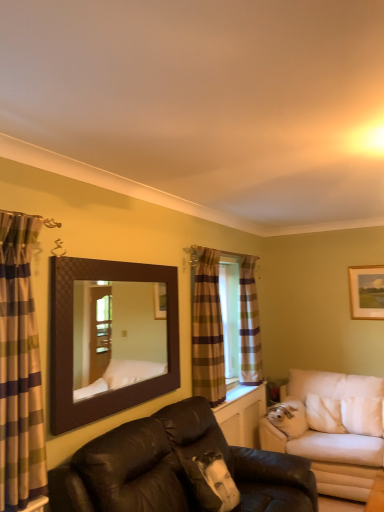
This screenshot has width=384, height=512. Describe the element at coordinates (175, 468) in the screenshot. I see `leather couch at center, the 2th studio couch when ordered from right to left` at that location.

Describe the element at coordinates (330, 430) in the screenshot. I see `white fabric studio couch at right, acting as the 2th studio couch starting from the front` at that location.

Where is `white fabric studio couch at right, which ranks as the 2th studio couch in left-to-right order`? white fabric studio couch at right, which ranks as the 2th studio couch in left-to-right order is located at coordinates [330, 430].

Locate an element on the screen. plaid fabric curtain at window, the third curtain in the left-to-right sequence is located at coordinates (249, 325).

This screenshot has width=384, height=512. What do you see at coordinates (19, 368) in the screenshot?
I see `plaid fabric curtain at left, marked as the third curtain in a right-to-left arrangement` at bounding box center [19, 368].

In order to face brown textured mirror at upper center, should I rotate leftwards or rightwards?

A 8.790 degree turn to the left will do.

Locate an element on the screen. The width and height of the screenshot is (384, 512). leather couch at center, which is counted as the 1th studio couch, starting from the left is located at coordinates (175, 468).

Is leather couch at center, which is counted as the 1th studio couch, starting from the left, in front of brown textured mirror at upper center?

Yes, the depth of leather couch at center, which is counted as the 1th studio couch, starting from the left, is less than that of brown textured mirror at upper center.

Based on the photo, is leather couch at center, which ranks as the 2th studio couch in back-to-front order, completely or partially outside of brown textured mirror at upper center?

Indeed, leather couch at center, which ranks as the 2th studio couch in back-to-front order, is completely outside brown textured mirror at upper center.

From a real-world perspective, is leather couch at center, which ranks as the 2th studio couch in back-to-front order, above or below brown textured mirror at upper center?

Clearly, from a real-world perspective, leather couch at center, which ranks as the 2th studio couch in back-to-front order, is below brown textured mirror at upper center.

The width and height of the screenshot is (384, 512). What are the coordinates of `mirror behind the leather couch at center, the 2th studio couch when ordered from right to left` in the screenshot? It's located at (110, 338).

Is plaid fabric curtain at center, which is counted as the second curtain, starting from the front, oriented towards leather couch at center, the 2th studio couch when ordered from right to left?

No.

From the image's perspective, count 1st studio couchs downward from the plaid fabric curtain at center, which is counted as the second curtain, starting from the front, and point to it. Please provide its 2D coordinates.

[(175, 468)]

Which object is positioned more to the right, plaid fabric curtain at center, placed as the second curtain when sorted from right to left, or leather couch at center, which ranks as the 2th studio couch in back-to-front order?

plaid fabric curtain at center, placed as the second curtain when sorted from right to left, is more to the right.

Can you confirm if plaid fabric curtain at center, placed as the second curtain when sorted from right to left, is smaller than leather couch at center, which is the 1th studio couch in front-to-back order?

Yes, plaid fabric curtain at center, placed as the second curtain when sorted from right to left, is smaller than leather couch at center, which is the 1th studio couch in front-to-back order.

Between plaid fabric curtain at center, placed as the second curtain when sorted from right to left, and wooden framed picture at upper right, which one is positioned behind?

wooden framed picture at upper right is behind.

Considering the sizes of objects plaid fabric curtain at center, which is counted as the second curtain, starting from the front, and wooden framed picture at upper right in the image provided, who is taller, plaid fabric curtain at center, which is counted as the second curtain, starting from the front, or wooden framed picture at upper right?

plaid fabric curtain at center, which is counted as the second curtain, starting from the front, is taller.

Is wooden framed picture at upper right a part of plaid fabric curtain at center, placed as the second curtain when sorted from right to left?

Actually, wooden framed picture at upper right is outside plaid fabric curtain at center, placed as the second curtain when sorted from right to left.

From a real-world perspective, is plaid fabric curtain at center, placed as the second curtain when sorted from right to left, physically located above or below wooden framed picture at upper right?

From a real-world perspective, plaid fabric curtain at center, placed as the second curtain when sorted from right to left, is physically below wooden framed picture at upper right.

Is leather couch at center, the 2th studio couch when ordered from right to left, thinner than plaid fabric curtain at window, the 1th curtain viewed from the right?

No.

Considering the positions of point (202, 423) and point (257, 367), is point (202, 423) closer or farther from the camera than point (257, 367)?

Point (202, 423) appears to be closer to the viewer than point (257, 367).

Can you confirm if leather couch at center, the 2th studio couch when ordered from right to left, is taller than plaid fabric curtain at window, the third curtain in the front-to-back sequence?

Incorrect, the height of leather couch at center, the 2th studio couch when ordered from right to left, is not larger of that of plaid fabric curtain at window, the third curtain in the front-to-back sequence.

Is leather couch at center, the 2th studio couch when ordered from right to left, completely or partially outside of plaid fabric curtain at window, the third curtain in the front-to-back sequence?

leather couch at center, the 2th studio couch when ordered from right to left, lies outside plaid fabric curtain at window, the third curtain in the front-to-back sequence,'s area.

Can you see leather couch at center, which is the 1th studio couch in front-to-back order, touching white fabric studio couch at right, placed as the first studio couch when sorted from right to left?

No, leather couch at center, which is the 1th studio couch in front-to-back order, is not making contact with white fabric studio couch at right, placed as the first studio couch when sorted from right to left.

Can white fabric studio couch at right, which ranks as the first studio couch in back-to-front order, be found inside leather couch at center, which is the 1th studio couch in front-to-back order?

No, white fabric studio couch at right, which ranks as the first studio couch in back-to-front order, is not inside leather couch at center, which is the 1th studio couch in front-to-back order.

From a real-world perspective, is leather couch at center, which is the 1th studio couch in front-to-back order, below white fabric studio couch at right, acting as the 2th studio couch starting from the front?

No, from a real-world perspective, leather couch at center, which is the 1th studio couch in front-to-back order, is not under white fabric studio couch at right, acting as the 2th studio couch starting from the front.

From the image's perspective, which is below, leather couch at center, the 2th studio couch when ordered from right to left, or white fabric studio couch at right, which ranks as the first studio couch in back-to-front order?

white fabric studio couch at right, which ranks as the first studio couch in back-to-front order, from the image's perspective.

Consider the image. Is plaid fabric curtain at window, the third curtain in the front-to-back sequence, in front of wooden framed picture at upper right?

Yes, the depth of plaid fabric curtain at window, the third curtain in the front-to-back sequence, is less than that of wooden framed picture at upper right.

From the image's perspective, does plaid fabric curtain at window, the 1th curtain viewed from the right, appear higher than wooden framed picture at upper right?

Actually, plaid fabric curtain at window, the 1th curtain viewed from the right, appears below wooden framed picture at upper right in the image.

Is plaid fabric curtain at window, arranged as the 1th curtain when viewed from the back, wider than wooden framed picture at upper right?

Indeed, plaid fabric curtain at window, arranged as the 1th curtain when viewed from the back, has a greater width compared to wooden framed picture at upper right.

Could you measure the distance between plaid fabric curtain at window, the third curtain in the front-to-back sequence, and wooden framed picture at upper right?

plaid fabric curtain at window, the third curtain in the front-to-back sequence, is 3.88 feet from wooden framed picture at upper right.

You are a GUI agent. You are given a task and a screenshot of the screen. Output one action in this format:
    pyautogui.click(x=<x>, y=<y>)
    Task: Click on the studio couch on the right of the plaid fabric curtain at window, the 1th curtain viewed from the right
    The image size is (384, 512).
    Given the screenshot: What is the action you would take?
    pyautogui.click(x=330, y=430)

Which object is thinner, plaid fabric curtain at window, the 1th curtain viewed from the right, or white fabric studio couch at right, placed as the first studio couch when sorted from right to left?

plaid fabric curtain at window, the 1th curtain viewed from the right, is thinner.

Do you think plaid fabric curtain at window, the 1th curtain viewed from the right, is within white fabric studio couch at right, which ranks as the 2th studio couch in left-to-right order, or outside of it?

The correct answer is: outside.

Is plaid fabric curtain at window, the third curtain in the front-to-back sequence, looking in the opposite direction of white fabric studio couch at right, which ranks as the 2th studio couch in left-to-right order?

No, plaid fabric curtain at window, the third curtain in the front-to-back sequence,'s orientation is not away from white fabric studio couch at right, which ranks as the 2th studio couch in left-to-right order.

Where is `mirror located on the left of leather couch at center, which is the 1th studio couch in front-to-back order`? mirror located on the left of leather couch at center, which is the 1th studio couch in front-to-back order is located at coordinates click(x=110, y=338).

The width and height of the screenshot is (384, 512). There is a plaid fabric curtain at center, marked as the second curtain in a left-to-right arrangement. Identify the location of the 1st studio couch below it (from a real-world perspective). (175, 468).

Which object lies further to the anchor point plaid fabric curtain at left, which is counted as the first curtain, starting from the left, plaid fabric curtain at center, marked as the second curtain in a left-to-right arrangement, or plaid fabric curtain at window, the 1th curtain viewed from the right?

plaid fabric curtain at window, the 1th curtain viewed from the right.

When comparing their distances from white fabric studio couch at right, acting as the 2th studio couch starting from the front, does plaid fabric curtain at left, marked as the third curtain in a right-to-left arrangement, or plaid fabric curtain at window, the 1th curtain viewed from the right, seem closer?

plaid fabric curtain at window, the 1th curtain viewed from the right.

Estimate the real-world distances between objects in this image. Which object is further from plaid fabric curtain at center, which ranks as the second curtain in back-to-front order, white fabric studio couch at right, placed as the first studio couch when sorted from right to left, or brown textured mirror at upper center?

white fabric studio couch at right, placed as the first studio couch when sorted from right to left, is further to plaid fabric curtain at center, which ranks as the second curtain in back-to-front order.

When comparing their distances from plaid fabric curtain at window, the third curtain in the front-to-back sequence, does white fabric studio couch at right, which ranks as the first studio couch in back-to-front order, or wooden framed picture at upper right seem further?

Among the two, wooden framed picture at upper right is located further to plaid fabric curtain at window, the third curtain in the front-to-back sequence.

Based on their spatial positions, is leather couch at center, which is counted as the 1th studio couch, starting from the left, or plaid fabric curtain at left, marked as the third curtain in a right-to-left arrangement, further from wooden framed picture at upper right?

Based on the image, plaid fabric curtain at left, marked as the third curtain in a right-to-left arrangement, appears to be further to wooden framed picture at upper right.

When comparing their distances from wooden framed picture at upper right, does leather couch at center, which is counted as the 1th studio couch, starting from the left, or plaid fabric curtain at window, the third curtain in the front-to-back sequence, seem further?

leather couch at center, which is counted as the 1th studio couch, starting from the left, is further to wooden framed picture at upper right.

Based on their spatial positions, is plaid fabric curtain at center, placed as the second curtain when sorted from right to left, or plaid fabric curtain at window, the 1th curtain viewed from the right, further from brown textured mirror at upper center?

Based on the image, plaid fabric curtain at window, the 1th curtain viewed from the right, appears to be further to brown textured mirror at upper center.

Consider the image. Which object lies further to the anchor point leather couch at center, which ranks as the 2th studio couch in back-to-front order, white fabric studio couch at right, placed as the first studio couch when sorted from right to left, or brown textured mirror at upper center?

white fabric studio couch at right, placed as the first studio couch when sorted from right to left, is further to leather couch at center, which ranks as the 2th studio couch in back-to-front order.

The image size is (384, 512). In order to click on curtain between plaid fabric curtain at center, marked as the second curtain in a left-to-right arrangement, and white fabric studio couch at right, which ranks as the 2th studio couch in left-to-right order, from top to bottom in this screenshot , I will do 249,325.

The height and width of the screenshot is (512, 384). I want to click on studio couch between brown textured mirror at upper center and plaid fabric curtain at window, the third curtain in the left-to-right sequence, in the front-back direction, so click(330, 430).

Where is `studio couch between leather couch at center, which is counted as the 1th studio couch, starting from the left, and plaid fabric curtain at center, placed as the second curtain when sorted from right to left, in the front-back direction`? studio couch between leather couch at center, which is counted as the 1th studio couch, starting from the left, and plaid fabric curtain at center, placed as the second curtain when sorted from right to left, in the front-back direction is located at coordinates click(x=330, y=430).

The height and width of the screenshot is (512, 384). Find the location of `mirror located between plaid fabric curtain at left, which is counted as the first curtain, starting from the left, and wooden framed picture at upper right in the depth direction`. mirror located between plaid fabric curtain at left, which is counted as the first curtain, starting from the left, and wooden framed picture at upper right in the depth direction is located at coordinates (110, 338).